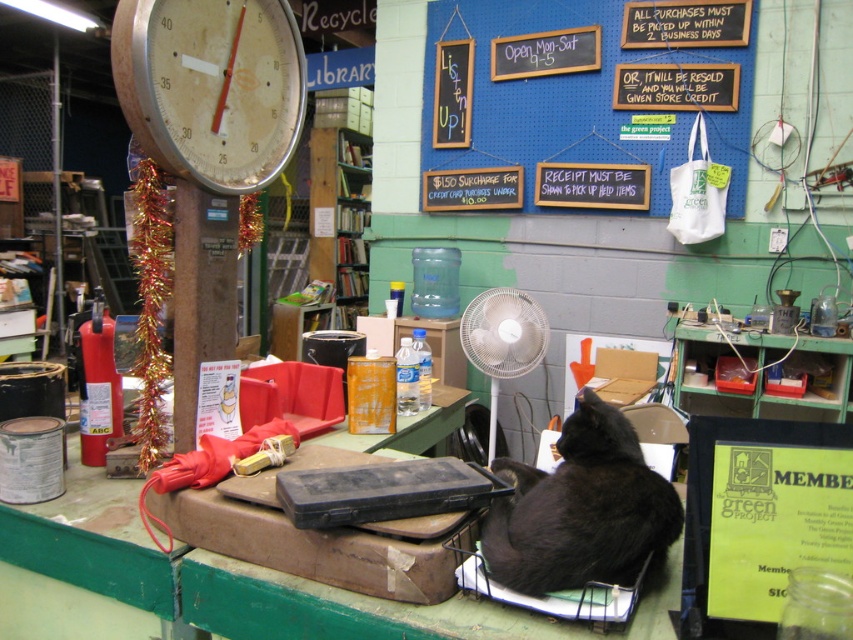
You are a customer in the store and want to read the text on the blue pegboard at upper center but there is a black fur cat at lower right blocking your view. Can you move around the cat to see the pegboard?

The blue pegboard at upper center is positioned on the right side of the black fur cat at lower right, so you can move to the left side of the cat to view the pegboard without obstruction.

You are standing in the thrift store and want to read the text on the blue pegboard at upper center. Considering your height, can you reach it without using a ladder?

The blue pegboard at upper center is 10.73 feet away from you, so you can easily reach it without needing a ladder since the distance is not too far.